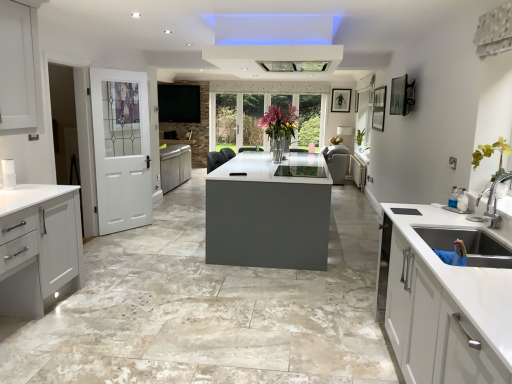
Locate an element on the screen. The height and width of the screenshot is (384, 512). free space in front of white painted wood door at left is located at coordinates (124, 240).